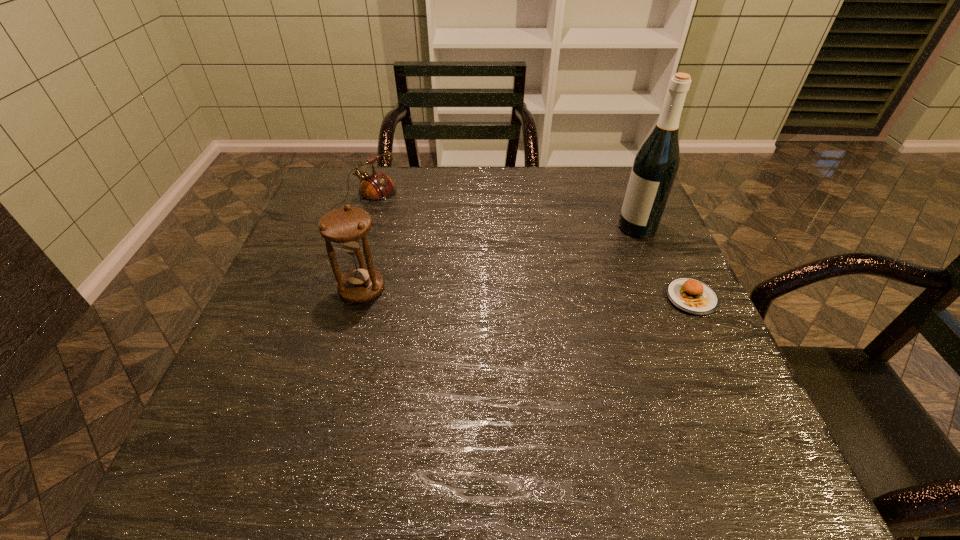
You are a GUI agent. You are given a task and a screenshot of the screen. Output one action in this format:
    pyautogui.click(x=<x>, y=<y>)
    Task: Click on the hourglass
    Image resolution: width=960 pixels, height=540 pixels.
    Given the screenshot: What is the action you would take?
    pyautogui.click(x=347, y=227)

This screenshot has height=540, width=960. I want to click on the shortest object, so click(694, 297).

Identify the location of the tallest object. The image size is (960, 540). (655, 166).

Locate an element on the screen. The height and width of the screenshot is (540, 960). the third tallest object is located at coordinates (375, 187).

This screenshot has width=960, height=540. What are the coordinates of `free location located 0.160m on the front of the second tallest object` in the screenshot? It's located at (341, 367).

I want to click on free region located 0.170m on the left of the shortest object, so click(x=590, y=298).

Find the location of a particular element. blank space located on the label of the wine bottle is located at coordinates (597, 248).

Locate an element on the screen. The width and height of the screenshot is (960, 540). free region located 0.380m on the label of the wine bottle is located at coordinates (509, 294).

In order to click on vacant space situated 0.310m on the label of the wine bottle in this screenshot , I will do click(533, 281).

Identify the location of vacant space located on the rotary dial of the third tallest object. click(443, 255).